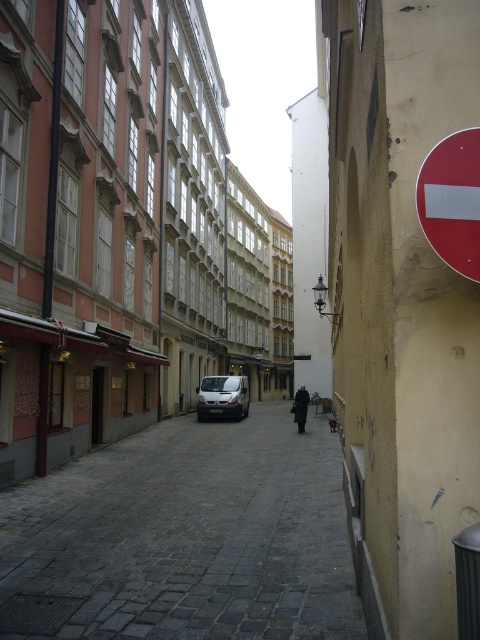
You are a delivery person trying to park your 2.5 meter wide truck in the narrow cobblestone street. The street has a red matte sign at right and a silver metallic van at center. Can you fit your truck between them?

The red matte sign at right is closer to the viewer than the silver metallic van at center, so the distance between them is not sufficient to accommodate a truck that is 2.5 meters wide.

You are a delivery person trying to navigate through the narrow cobblestone street. You see a red matte sign at right and a black metal pole at left. Which object is shorter in height?

The red matte sign at right has a lesser height compared to the black metal pole at left, so the red matte sign at right is shorter.